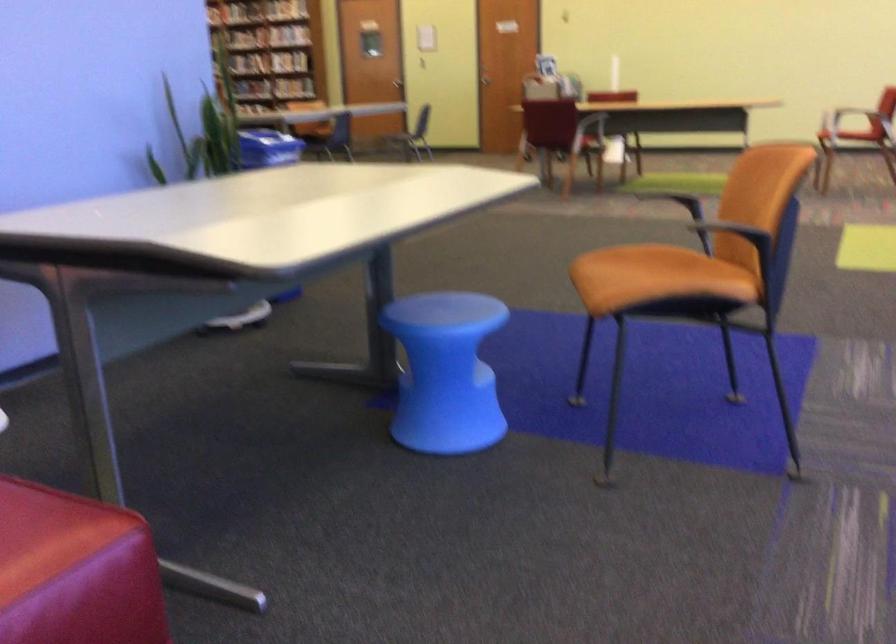
The location [268,147] corresponds to which object?

It refers to a blue plastic bin.